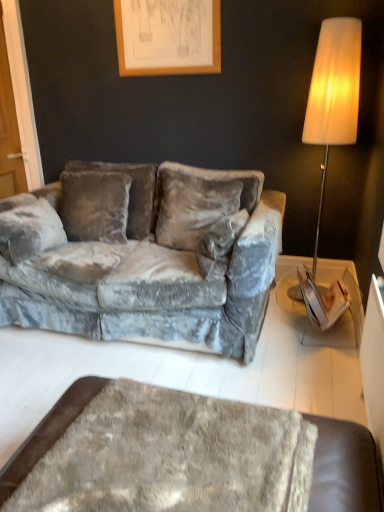
Question: From a real-world perspective, is wooden picture frame at upper center beneath velvet gray couch at center?

Choices:
 (A) yes
 (B) no

Answer: (B)

Question: Is wooden picture frame at upper center with velvet gray couch at center?

Choices:
 (A) yes
 (B) no

Answer: (B)

Question: From the image's perspective, is wooden picture frame at upper center beneath velvet gray couch at center?

Choices:
 (A) no
 (B) yes

Answer: (A)

Question: Does wooden picture frame at upper center have a larger size compared to velvet gray couch at center?

Choices:
 (A) no
 (B) yes

Answer: (A)

Question: Can velvet gray couch at center be found inside wooden picture frame at upper center?

Choices:
 (A) yes
 (B) no

Answer: (B)

Question: Is wooden picture frame at upper center facing towards velvet gray couch at center?

Choices:
 (A) no
 (B) yes

Answer: (A)

Question: Is velvet gray couch at center positioned beyond the bounds of wooden picture frame at upper center?

Choices:
 (A) no
 (B) yes

Answer: (B)

Question: Does velvet gray couch at center have a larger size compared to wooden picture frame at upper center?

Choices:
 (A) no
 (B) yes

Answer: (B)

Question: Is velvet gray couch at center to the left of wooden picture frame at upper center from the viewer's perspective?

Choices:
 (A) no
 (B) yes

Answer: (B)

Question: Is velvet gray couch at center turned away from wooden picture frame at upper center?

Choices:
 (A) no
 (B) yes

Answer: (A)

Question: Can you confirm if velvet gray couch at center is thinner than wooden picture frame at upper center?

Choices:
 (A) no
 (B) yes

Answer: (A)

Question: From a real-world perspective, is velvet gray couch at center on wooden picture frame at upper center?

Choices:
 (A) yes
 (B) no

Answer: (B)

Question: Is wooden picture frame at upper center positioned far away from fuzzy brown ottoman at lower center?

Choices:
 (A) yes
 (B) no

Answer: (A)